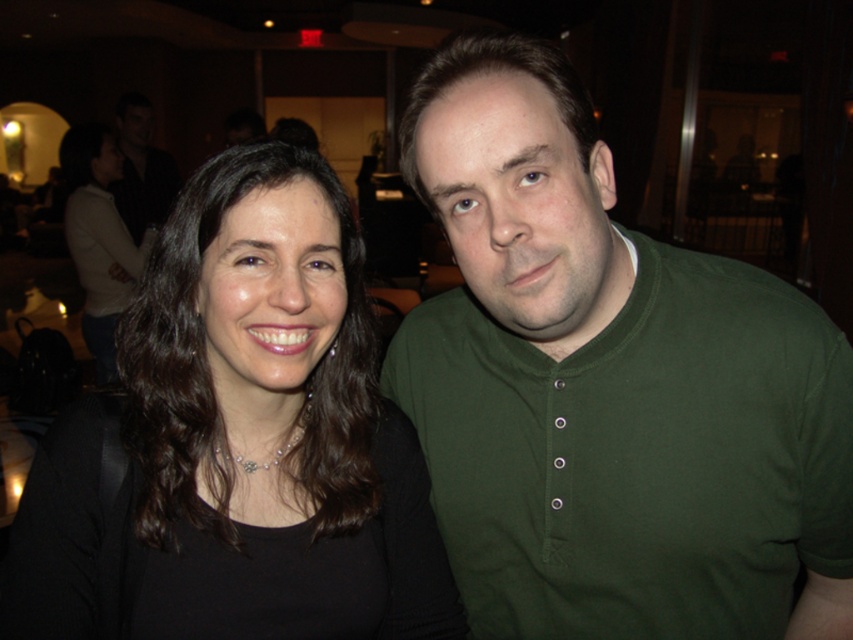
Based on the photo, you are a photographer setting up for a group photo. You see the black matte shirt at center and the matte black shirt at upper left. How far apart are these two people wearing black shirts?

The distance between the black matte shirt at center and the matte black shirt at upper left is 9.69 feet.

You are organizing a clothing display and need to arrange the green cotton shirt at center and the black matte shirt at center on a rack. The rack has two hangers placed vertically. The upper hanger is for taller items. Which shirt should you place on the upper hanger?

The green cotton shirt at center is taller than the black matte shirt at center, so it should be placed on the upper hanger designed for taller items.